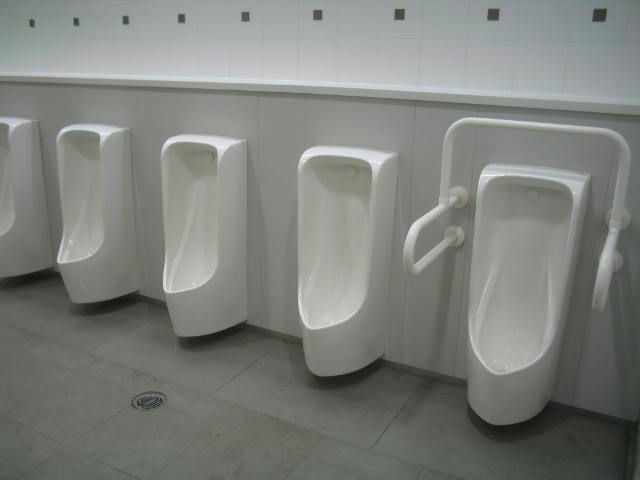
What are the coordinates of `urinals` in the screenshot? It's located at (17, 230), (99, 266), (211, 289), (346, 324), (524, 369).